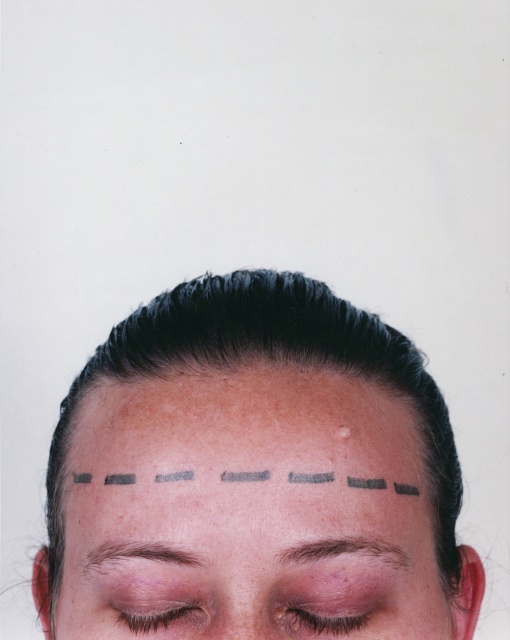
Is matte gray dashed line at center thinner than brown matte eyebrow at center?

No.

Does matte gray dashed line at center have a larger size compared to brown matte eyebrow at center?

Yes, matte gray dashed line at center is bigger than brown matte eyebrow at center.

Locate an element on the screen. This screenshot has width=510, height=640. matte gray dashed line at center is located at coordinates (253, 461).

Which is more to the left, matte pink eyelid at center or smooth skin nose at center?

smooth skin nose at center is more to the left.

This screenshot has height=640, width=510. Identify the location of matte pink eyelid at center. (322, 609).

Is the position of dry skin at center less distant than that of matte pink eyelid at center?

Yes, dry skin at center is closer to the viewer.

Between dry skin at center and matte pink eyelid at center, which one appears on the left side from the viewer's perspective?

dry skin at center is more to the left.

Who is more distant from viewer, (268, 452) or (340, 596)?

Positioned behind is point (340, 596).

Identify the location of dry skin at center. (243, 426).